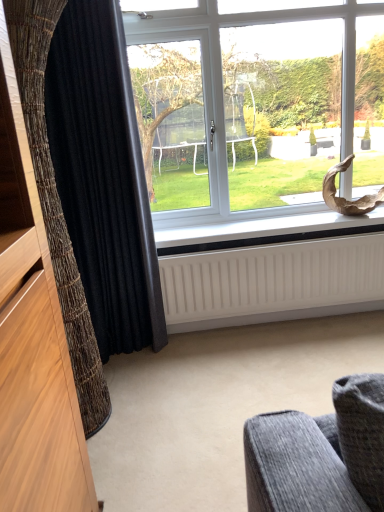
Question: Considering the positions of point (43, 110) and point (127, 166), is point (43, 110) closer or farther from the camera than point (127, 166)?

Choices:
 (A) closer
 (B) farther

Answer: (A)

Question: In terms of width, does black textured curtain at left, which is counted as the first curtain, starting from the front, look wider or thinner when compared to black textured curtain at left, which appears as the second curtain when viewed from the front?

Choices:
 (A) wide
 (B) thin

Answer: (A)

Question: Based on their relative distances, which object is farther from the white matte radiator at lower center?

Choices:
 (A) transparent glass window at center
 (B) black textured curtain at left, positioned as the 2th curtain in back-to-front order
 (C) white ribbed radiator at lower center
 (D) black textured curtain at left, the first curtain positioned from the back

Answer: (B)

Question: Estimate the real-world distances between objects in this image. Which object is farther from the white ribbed radiator at lower center?

Choices:
 (A) black textured curtain at left, which is counted as the first curtain, starting from the front
 (B) transparent glass window at center
 (C) white matte radiator at lower center
 (D) black textured curtain at left, which appears as the second curtain when viewed from the front

Answer: (A)